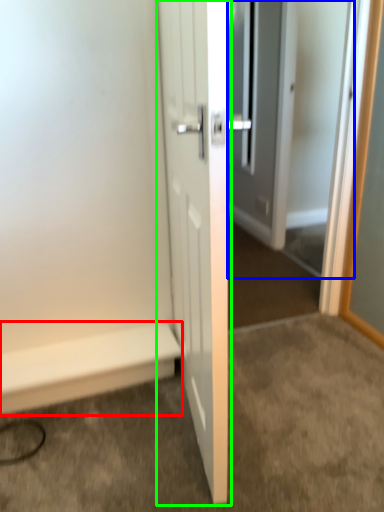
Question: Which is farther away from stairwell (highlighted by a red box)? screen door (highlighted by a blue box) or door (highlighted by a green box)?

Choices:
 (A) screen door
 (B) door

Answer: (A)